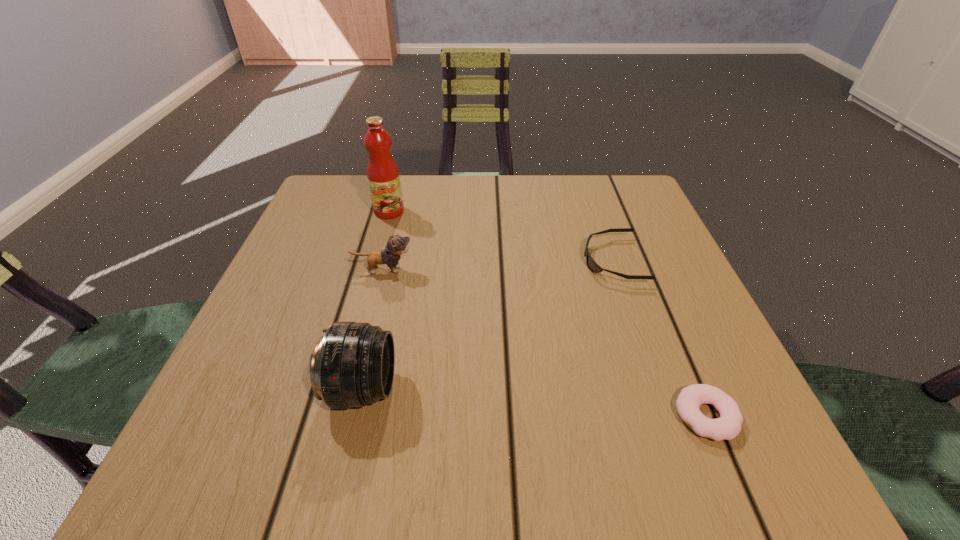
The width and height of the screenshot is (960, 540). I want to click on object positioned at the far left corner, so click(x=383, y=176).

Image resolution: width=960 pixels, height=540 pixels. Identify the location of object that is positioned at the near right corner. (728, 426).

The image size is (960, 540). I want to click on free space at the far edge, so click(x=492, y=181).

In order to click on blank space at the left edge of the desktop in this screenshot , I will do `click(283, 280)`.

Image resolution: width=960 pixels, height=540 pixels. In order to click on vacant space at the right edge of the desktop in this screenshot , I will do `click(661, 247)`.

Image resolution: width=960 pixels, height=540 pixels. In the image, there is a desktop. What are the coordinates of `vacant space at the far left corner` in the screenshot? It's located at (351, 179).

Where is `vacant space at the far right corner of the desktop`? Image resolution: width=960 pixels, height=540 pixels. vacant space at the far right corner of the desktop is located at coordinates (644, 230).

This screenshot has height=540, width=960. Find the location of `vacant region at the near right corner of the desktop`. vacant region at the near right corner of the desktop is located at coordinates (713, 474).

Image resolution: width=960 pixels, height=540 pixels. Find the location of `free area in between the sunglasses and the tallest object`. free area in between the sunglasses and the tallest object is located at coordinates (501, 236).

Locate an element on the screen. The width and height of the screenshot is (960, 540). free space between the doughnut and the sunglasses is located at coordinates (660, 338).